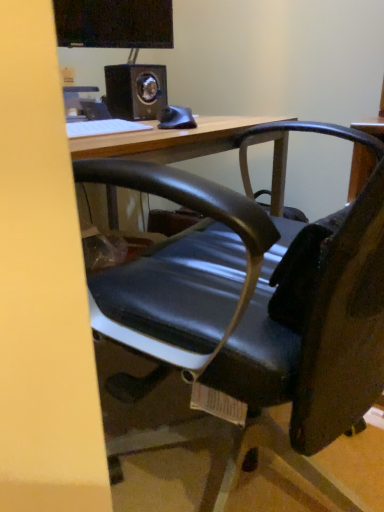
Question: Would you say wooden desk at center is inside or outside black glossy monitor at upper center?

Choices:
 (A) outside
 (B) inside

Answer: (A)

Question: From a real-world perspective, is wooden desk at center positioned above or below black glossy monitor at upper center?

Choices:
 (A) above
 (B) below

Answer: (B)

Question: Which object is the closest to the white matte keyboard at upper left?

Choices:
 (A) metallic black speaker at upper center
 (B) black glossy monitor at upper center
 (C) wooden desk at center

Answer: (A)

Question: Estimate the real-world distances between objects in this image. Which object is farther from the white matte keyboard at upper left?

Choices:
 (A) metallic black speaker at upper center
 (B) black glossy monitor at upper center
 (C) wooden desk at center

Answer: (B)